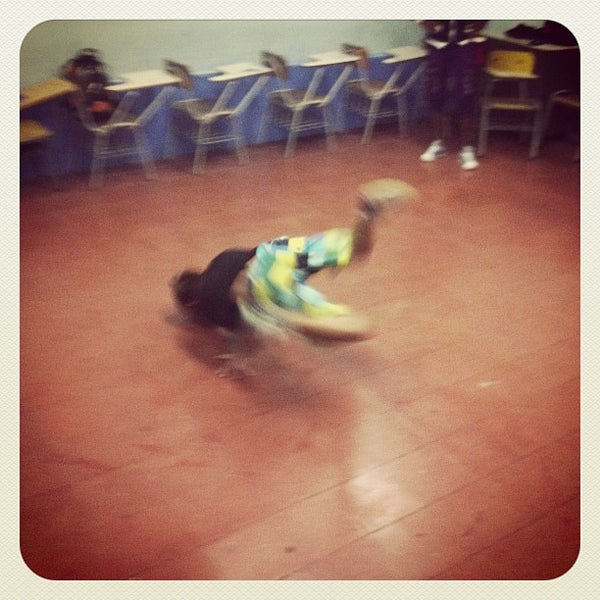
The image size is (600, 600). In order to click on desk tops in this screenshot , I will do `click(147, 80)`, `click(52, 89)`, `click(243, 70)`, `click(333, 57)`, `click(333, 349)`, `click(407, 54)`, `click(515, 73)`.